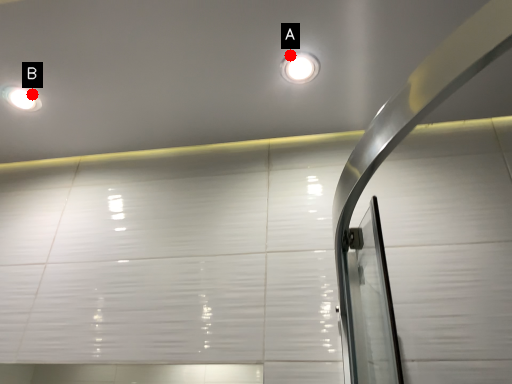
Question: Two points are circled on the image, labeled by A and B beside each circle. Which point is closer to the camera?

Choices:
 (A) A is closer
 (B) B is closer

Answer: (A)